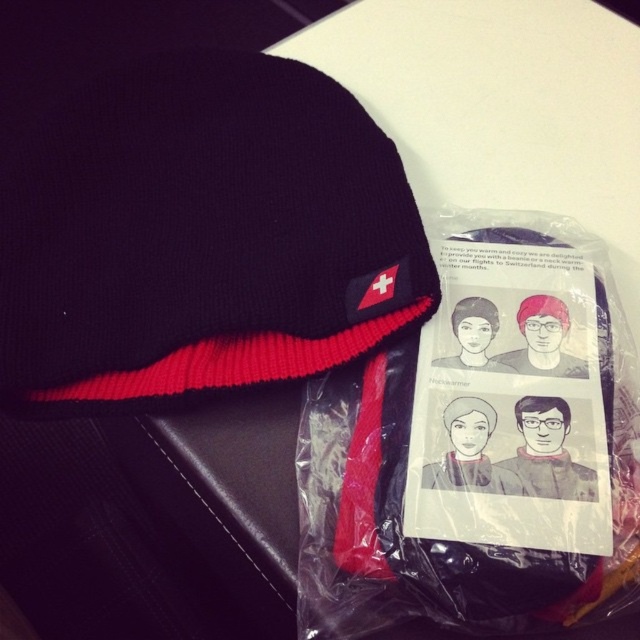
Question: Is black knitted beanie at center closer to camera compared to matte plastic bag at center?

Choices:
 (A) yes
 (B) no

Answer: (B)

Question: Which of the following is the closest to the observer?

Choices:
 (A) black knitted beanie at center
 (B) matte plastic bag at center
 (C) matte black beanie at upper center

Answer: (B)

Question: Which of the following is the farthest from the observer?

Choices:
 (A) matte plastic bag at center
 (B) matte black beanie at upper center

Answer: (B)

Question: Is black knitted beanie at center to the right of matte black beanie at upper center from the viewer's perspective?

Choices:
 (A) yes
 (B) no

Answer: (B)

Question: Which point is farther to the camera?

Choices:
 (A) (524, 328)
 (B) (545, 387)

Answer: (A)

Question: Does black knitted beanie at center appear under matte black beanie at upper center?

Choices:
 (A) yes
 (B) no

Answer: (B)